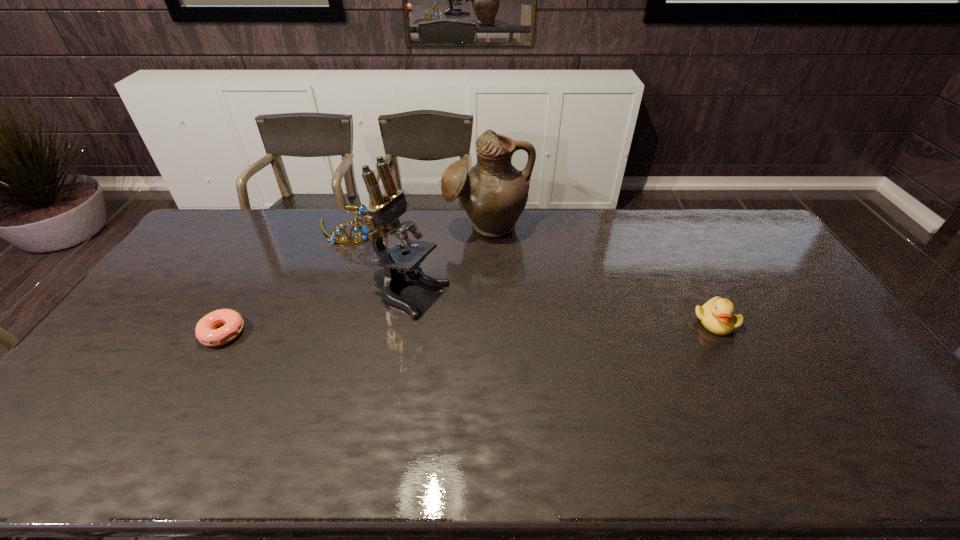
This screenshot has height=540, width=960. In order to click on the shortest object in this screenshot , I will do `click(207, 334)`.

Locate an element on the screen. doughnut is located at coordinates (207, 334).

The image size is (960, 540). In order to click on the second shortest object in this screenshot , I will do `click(717, 315)`.

You are a GUI agent. You are given a task and a screenshot of the screen. Output one action in this format:
    pyautogui.click(x=<x>, y=<y>)
    Task: Click on the rightmost object
    The height and width of the screenshot is (540, 960).
    Given the screenshot: What is the action you would take?
    pyautogui.click(x=717, y=315)

This screenshot has height=540, width=960. I want to click on the fourth object from right to left, so click(x=361, y=208).

Find the location of a particular element. tiara is located at coordinates (361, 208).

Where is `microscope`? This screenshot has width=960, height=540. microscope is located at coordinates (382, 217).

Locate an element on the screen. The width and height of the screenshot is (960, 540). the second tallest object is located at coordinates (494, 193).

This screenshot has height=540, width=960. Find the location of `free spot located 0.200m on the front of the leftmost object`. free spot located 0.200m on the front of the leftmost object is located at coordinates (177, 415).

This screenshot has width=960, height=540. I want to click on vacant space located at the face of the second shortest object, so click(731, 350).